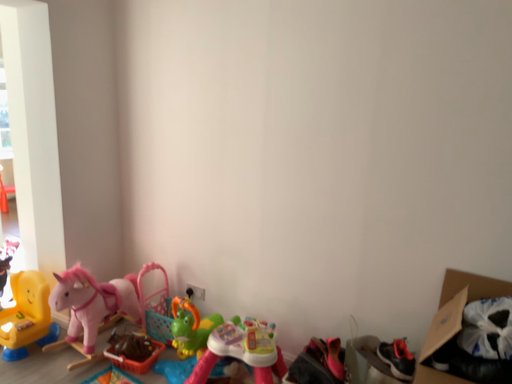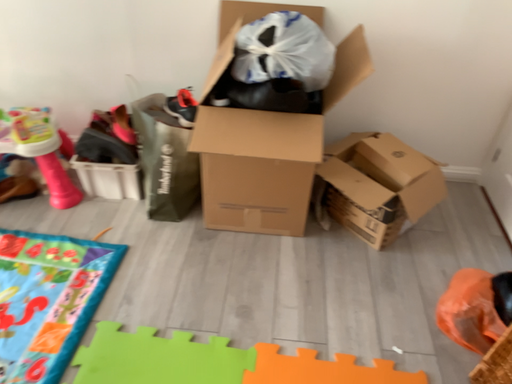
Question: How did the camera likely rotate when shooting the video?

Choices:
 (A) rotated downward
 (B) rotated upward

Answer: (A)